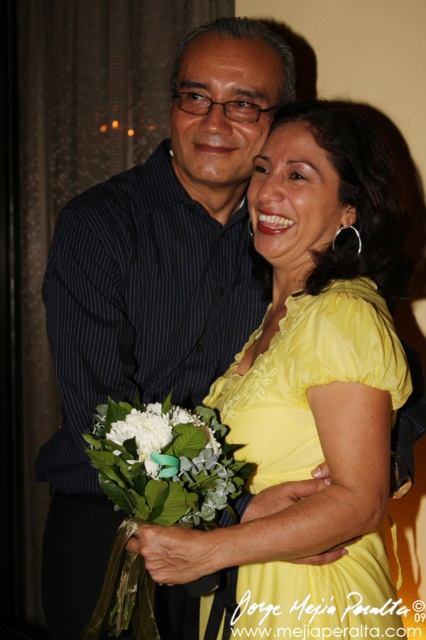
In the scene, you see a yellow satin dress at center and a white matte flower at center. Which object is positioned to the right side?

The yellow satin dress at center is to the right of the white matte flower at center.

You are a photographer standing at a distance of 3 feet from the yellow satin dress at center. Can you capture the entire dress in your camera frame without moving closer or farther away?

The yellow satin dress at center is 3.65 feet away from the viewer. Since you are 3 feet away, you are closer than the required distance, so you can capture the entire dress in your camera frame without moving.

What are the coordinates of the yellow satin dress at center?

The yellow satin dress at center is located at coordinates point (307, 376).